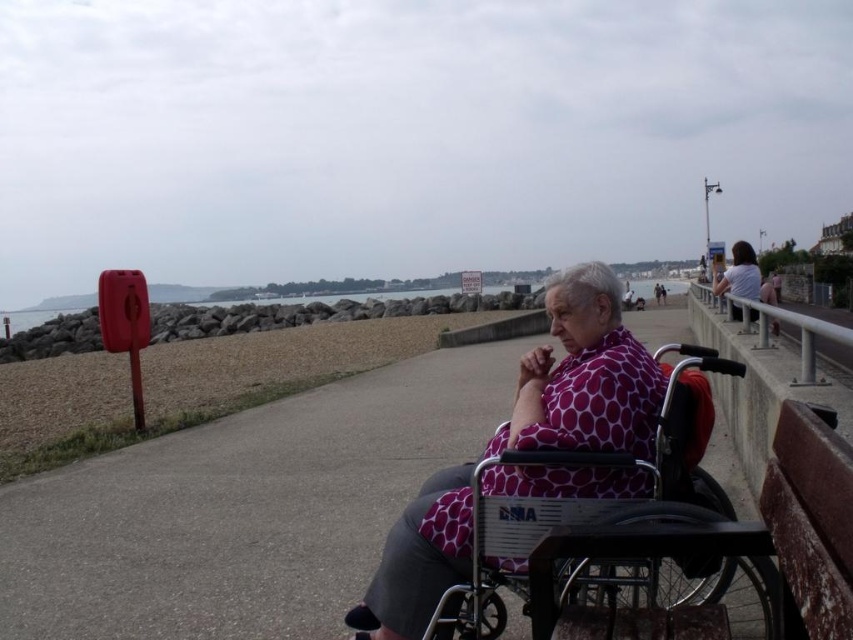
You are a visually impaired person using a cane to navigate the seaside promenade. You feel the surface under your cane change from concrete at center to polka dot fabric at center. Which surface is closer to you?

The concrete at center is closer to you because it is further to the viewer than the polka dot fabric at center.

You are a delivery robot navigating the seaside promenade. Your current position is at point 0.797, 0.286. You need to deliver a package to the person in the wheelchair at the foreground. Which direction should you move relative to the concrete at center?

The concrete at center is located at point (242, 509), which is your current position. Therefore, you are already at the concrete at center. To reach the person in the wheelchair, you should move forward along the promenade towards the foreground where the wheelchair is located.